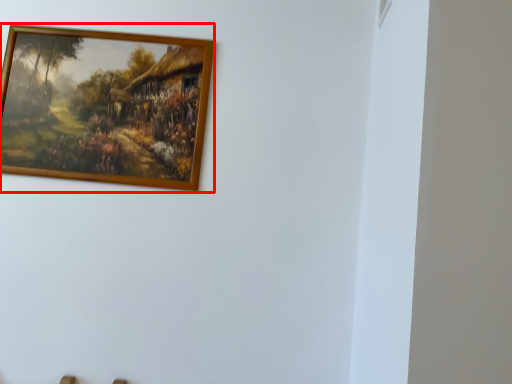
Question: From the image's perspective, what is the correct spatial relationship of picture frame (annotated by the red box) in relation to window?

Choices:
 (A) below
 (B) above

Answer: (A)